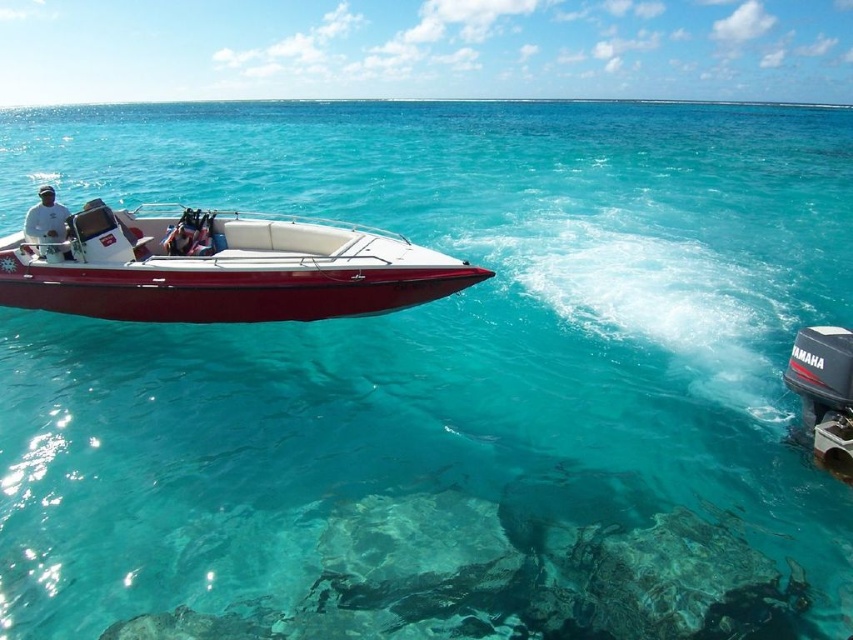
Question: Considering the relative positions of black rubber outboard motor at lower right and white matte shirt at left in the image provided, where is black rubber outboard motor at lower right located with respect to white matte shirt at left?

Choices:
 (A) below
 (B) above

Answer: (A)

Question: Which object is positioned closest to the glossy fiberglass speedboat at left?

Choices:
 (A) white matte shirt at left
 (B) black rubber outboard motor at lower right

Answer: (A)

Question: Can you confirm if glossy fiberglass speedboat at left is smaller than black rubber outboard motor at lower right?

Choices:
 (A) no
 (B) yes

Answer: (B)

Question: Which point appears farthest from the camera in this image?

Choices:
 (A) (62, 225)
 (B) (842, 420)

Answer: (A)

Question: Is glossy fiberglass speedboat at left wider than black rubber outboard motor at lower right?

Choices:
 (A) no
 (B) yes

Answer: (A)

Question: Which of the following is the closest to the observer?

Choices:
 (A) (57, 230)
 (B) (131, 230)
 (C) (834, 364)

Answer: (C)